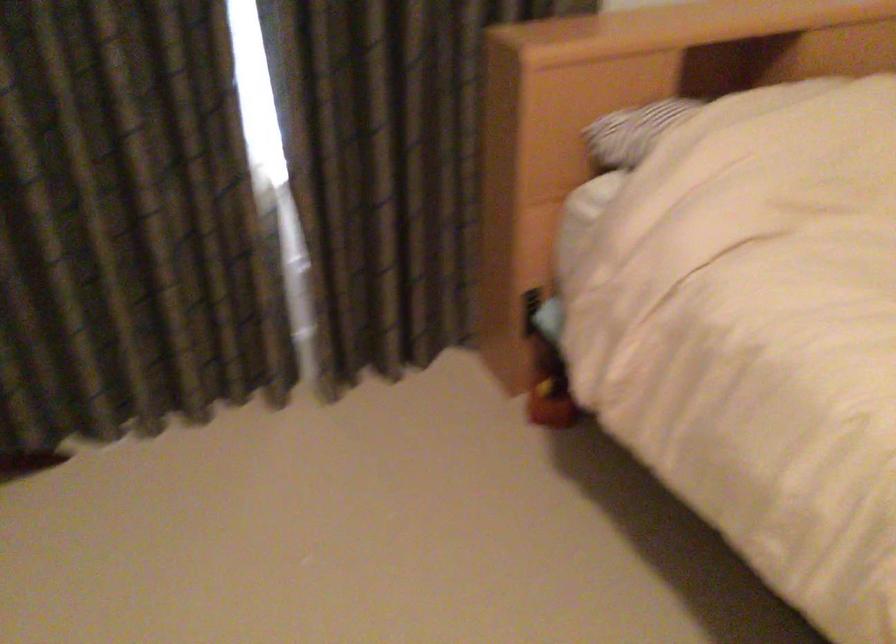
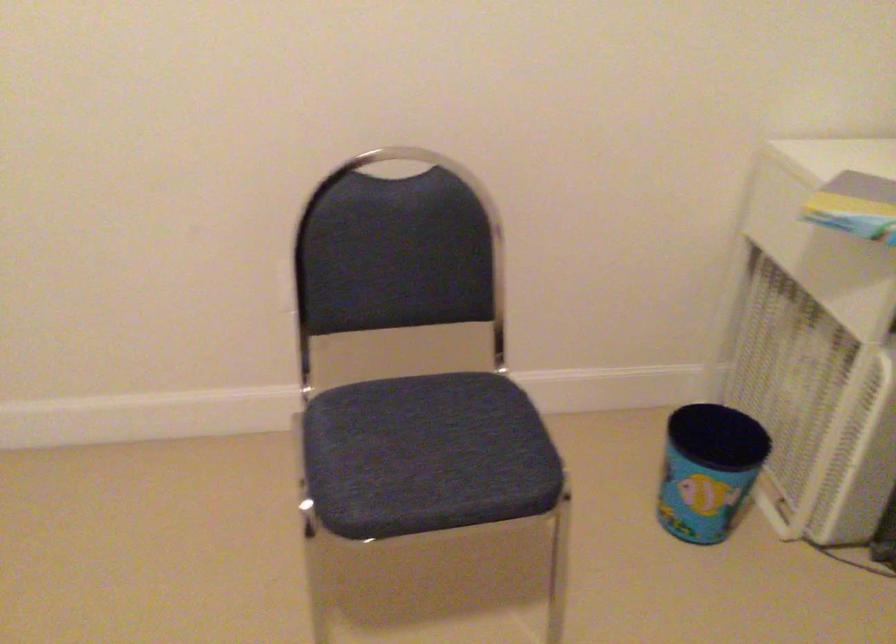
First-person continuous shooting, in which direction is the camera rotating?

The camera rotated toward left-down.